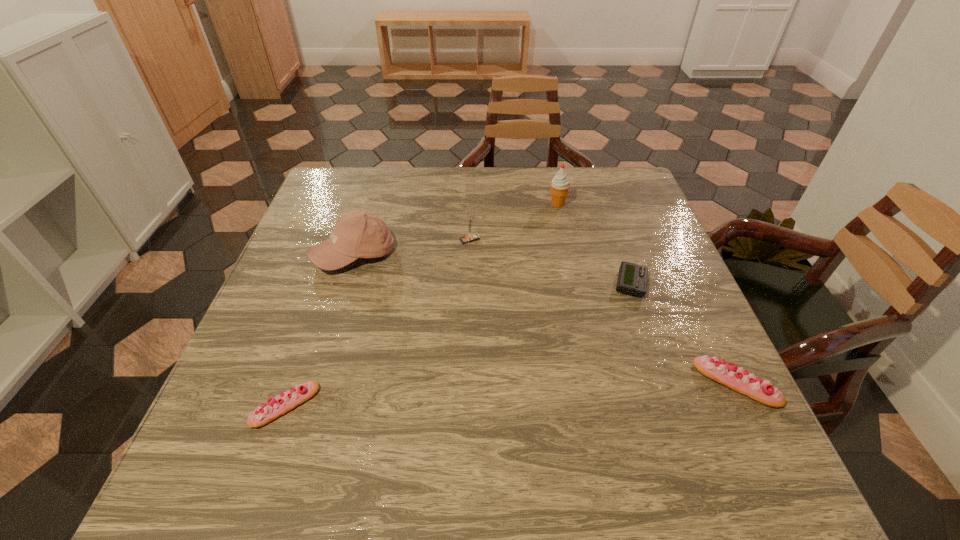
The image size is (960, 540). Find the location of `baseball cap`. baseball cap is located at coordinates (357, 234).

I want to click on free space located on the back of the shorter eclair, so click(x=329, y=279).

Find the location of a particular element. This screenshot has height=540, width=960. free space located 0.080m on the back of the taller eclair is located at coordinates (709, 328).

Identify the location of vacant region located 0.400m on the front of the farthest object. Image resolution: width=960 pixels, height=540 pixels. (583, 319).

At what (x,y) coordinates should I click in order to perform the action: click on vacant space located 0.340m on the back of the beeper. Please return your answer as a coordinate pair (x, y). The height and width of the screenshot is (540, 960). Looking at the image, I should click on (598, 191).

The height and width of the screenshot is (540, 960). I want to click on vacant space situated 0.180m on the back of the third object from left to right, so click(x=471, y=195).

Find the location of a particular element. free space located 0.370m on the front-facing side of the baseball cap is located at coordinates tap(300, 427).

Where is `object that is at the far edge`? This screenshot has height=540, width=960. object that is at the far edge is located at coordinates (560, 184).

You are a GUI agent. You are given a task and a screenshot of the screen. Output one action in this format:
    pyautogui.click(x=<x>, y=<y>)
    Task: Click on the eclair that is positioned at the left edge
    The height and width of the screenshot is (540, 960).
    Given the screenshot: What is the action you would take?
    pyautogui.click(x=281, y=404)

Image resolution: width=960 pixels, height=540 pixels. I want to click on baseball cap that is at the left edge, so click(357, 234).